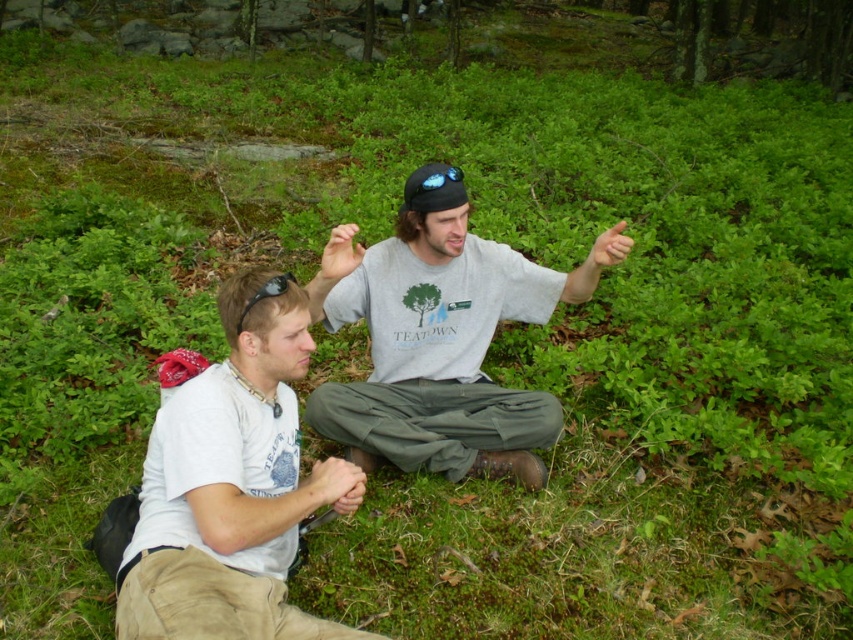
You are planning to take a photo of the gray cotton shirt at center and the black matte baseball cap at center. Since you want both items to appear the same size in the photo, what should you do?

The gray cotton shirt at center is bigger than the black matte baseball cap at center. To make them appear the same size in the photo, move closer to the black matte baseball cap at center and farther from the gray cotton shirt at center.

You are a photographer trying to capture a closeup shot of the gray cotton shirt at center and the matte gray hand at center. Your camera has a minimum focusing distance of 50 centimeters. Can you take the photo without moving either object?

The distance between the gray cotton shirt at center and the matte gray hand at center is 53.41 centimeters, which is greater than the camera minimum focusing distance of 50 centimeters. Therefore, you can take the photo without moving either object.